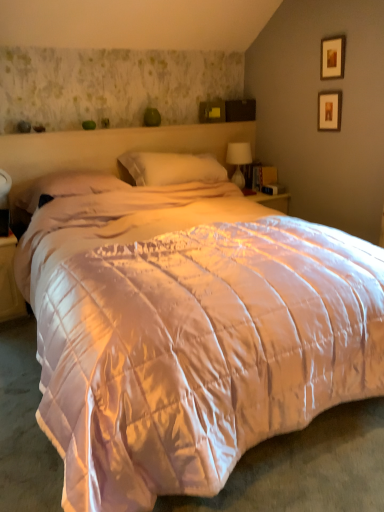
The height and width of the screenshot is (512, 384). Describe the element at coordinates (9, 281) in the screenshot. I see `matte white nightstand at lower left` at that location.

The image size is (384, 512). In order to click on white soft pillow at center, positioned as the 2th pillow in left-to-right order in this screenshot , I will do `click(169, 168)`.

The height and width of the screenshot is (512, 384). What do you see at coordinates (169, 168) in the screenshot?
I see `white soft pillow at center, positioned as the 2th pillow in left-to-right order` at bounding box center [169, 168].

What do you see at coordinates (238, 160) in the screenshot?
I see `translucent glass table lamp at upper right` at bounding box center [238, 160].

What do you see at coordinates (332, 57) in the screenshot?
I see `wooden picture frame at upper right, placed as the second picture frame when sorted from bottom to top` at bounding box center [332, 57].

In the scene shown: How much space does wooden picture frame at upper right, arranged as the second picture frame when viewed from the top, occupy horizontally?

wooden picture frame at upper right, arranged as the second picture frame when viewed from the top, is 1.82 inches wide.

Locate an element on the screen. This screenshot has height=512, width=384. wooden picture frame at upper right, acting as the first picture frame starting from the bottom is located at coordinates (329, 110).

Where is `matte white nightstand at lower left`? matte white nightstand at lower left is located at coordinates (9, 281).

Consider the image. How different are the orientations of wooden picture frame at upper right, placed as the second picture frame when sorted from bottom to top, and matte white nightstand at lower left in degrees?

They differ by 89.2 degrees in their facing directions.

Could you tell me if wooden picture frame at upper right, which appears as the 1th picture frame when viewed from the top, is turned towards matte white nightstand at lower left?

No, wooden picture frame at upper right, which appears as the 1th picture frame when viewed from the top, is not oriented towards matte white nightstand at lower left.

Is wooden picture frame at upper right, which appears as the 1th picture frame when viewed from the top, touching matte white nightstand at lower left?

No, wooden picture frame at upper right, which appears as the 1th picture frame when viewed from the top, is not with matte white nightstand at lower left.

From the picture: Does wooden picture frame at upper right, placed as the second picture frame when sorted from bottom to top, have a lesser height compared to matte white nightstand at lower left?

Yes.

Does wooden picture frame at upper right, acting as the first picture frame starting from the bottom, have a lesser width compared to translucent glass table lamp at upper right?

Yes.

From a real-world perspective, which is physically below, wooden picture frame at upper right, acting as the first picture frame starting from the bottom, or translucent glass table lamp at upper right?

In real-world perspective, translucent glass table lamp at upper right is lower.

Can you tell me how much wooden picture frame at upper right, acting as the first picture frame starting from the bottom, and translucent glass table lamp at upper right differ in facing direction?

89.7 degrees.

Is wooden picture frame at upper right, acting as the first picture frame starting from the bottom, in front of or behind translucent glass table lamp at upper right in the image?

In the image, wooden picture frame at upper right, acting as the first picture frame starting from the bottom, appears in front of translucent glass table lamp at upper right.

Are wooden picture frame at upper right, acting as the first picture frame starting from the bottom, and pink satin pillow at center, the second pillow viewed from the right, making contact?

No, wooden picture frame at upper right, acting as the first picture frame starting from the bottom, is not beside pink satin pillow at center, the second pillow viewed from the right.

Considering the positions of point (325, 112) and point (33, 203), is point (325, 112) closer or farther from the camera than point (33, 203)?

Point (325, 112) is positioned farther from the camera compared to point (33, 203).

From a real-world perspective, between wooden picture frame at upper right, arranged as the second picture frame when viewed from the top, and pink satin pillow at center, the second pillow viewed from the right, who is vertically higher?

From a 3D spatial view, wooden picture frame at upper right, arranged as the second picture frame when viewed from the top, is above.

Does wooden picture frame at upper right, acting as the first picture frame starting from the bottom, turn towards pink satin pillow at center, the second pillow viewed from the right?

Yes.

Is matte white nightstand at lower left further to camera compared to wooden picture frame at upper right, acting as the first picture frame starting from the bottom?

No, the depth of matte white nightstand at lower left is less than that of wooden picture frame at upper right, acting as the first picture frame starting from the bottom.

Is matte white nightstand at lower left next to wooden picture frame at upper right, arranged as the second picture frame when viewed from the top, and touching it?

matte white nightstand at lower left and wooden picture frame at upper right, arranged as the second picture frame when viewed from the top, are not in contact.

Would you say matte white nightstand at lower left is inside or outside wooden picture frame at upper right, arranged as the second picture frame when viewed from the top?

matte white nightstand at lower left is not enclosed by wooden picture frame at upper right, arranged as the second picture frame when viewed from the top.

Is translucent glass table lamp at upper right facing away from wooden picture frame at upper right, acting as the first picture frame starting from the bottom?

No, translucent glass table lamp at upper right's orientation is not away from wooden picture frame at upper right, acting as the first picture frame starting from the bottom.

Looking at this image, would you say translucent glass table lamp at upper right is to the left or to the right of wooden picture frame at upper right, acting as the first picture frame starting from the bottom, in the picture?

From the image, it's evident that translucent glass table lamp at upper right is to the left of wooden picture frame at upper right, acting as the first picture frame starting from the bottom.

How distant is translucent glass table lamp at upper right from wooden picture frame at upper right, arranged as the second picture frame when viewed from the top?

translucent glass table lamp at upper right and wooden picture frame at upper right, arranged as the second picture frame when viewed from the top, are 31.29 inches apart.

Consider the image. Is translucent glass table lamp at upper right not inside wooden picture frame at upper right, arranged as the second picture frame when viewed from the top?

Indeed, translucent glass table lamp at upper right is completely outside wooden picture frame at upper right, arranged as the second picture frame when viewed from the top.

Does white soft pillow at center, the 1th pillow when ordered from right to left, turn towards pink satin pillow at center, which is counted as the 1th pillow, starting from the left?

No, white soft pillow at center, the 1th pillow when ordered from right to left, is not oriented towards pink satin pillow at center, which is counted as the 1th pillow, starting from the left.

At what (x,y) coordinates should I click in order to perform the action: click on pillow above the pink satin pillow at center, the second pillow viewed from the right (from a real-world perspective). Please return your answer as a coordinate pair (x, y). The image size is (384, 512). Looking at the image, I should click on (169, 168).

From a real-world perspective, is wooden picture frame at upper right, acting as the first picture frame starting from the bottom, physically below matte white nightstand at lower left?

No, from a real-world perspective, wooden picture frame at upper right, acting as the first picture frame starting from the bottom, is not below matte white nightstand at lower left.

Can you tell me how much wooden picture frame at upper right, acting as the first picture frame starting from the bottom, and matte white nightstand at lower left differ in facing direction?

89.2 degrees separate the facing orientations of wooden picture frame at upper right, acting as the first picture frame starting from the bottom, and matte white nightstand at lower left.

This screenshot has height=512, width=384. Find the location of `nightstand lying on the left of wooden picture frame at upper right, arranged as the second picture frame when viewed from the top`. nightstand lying on the left of wooden picture frame at upper right, arranged as the second picture frame when viewed from the top is located at coordinates (9, 281).

From the image's perspective, is wooden picture frame at upper right, arranged as the second picture frame when viewed from the top, above or below matte white nightstand at lower left?

wooden picture frame at upper right, arranged as the second picture frame when viewed from the top, is above matte white nightstand at lower left.

Where is `nightstand located underneath the wooden picture frame at upper right, placed as the second picture frame when sorted from bottom to top (from a real-world perspective)`? nightstand located underneath the wooden picture frame at upper right, placed as the second picture frame when sorted from bottom to top (from a real-world perspective) is located at coordinates (9, 281).

Locate an element on the screen. the 1st picture frame in front of the translucent glass table lamp at upper right, starting your count from the anchor is located at coordinates tap(329, 110).

When comparing their distances from white soft pillow at center, positioned as the 2th pillow in left-to-right order, does translucent glass table lamp at upper right or pink satin pillow at center, the second pillow viewed from the right, seem further?

The object further to white soft pillow at center, positioned as the 2th pillow in left-to-right order, is translucent glass table lamp at upper right.

When comparing their distances from wooden picture frame at upper right, acting as the first picture frame starting from the bottom, does wooden picture frame at upper right, which appears as the 1th picture frame when viewed from the top, or pink satin pillow at center, which is counted as the 1th pillow, starting from the left, seem closer?

wooden picture frame at upper right, which appears as the 1th picture frame when viewed from the top.

Looking at the image, which one is located further to translucent glass table lamp at upper right, wooden picture frame at upper right, arranged as the second picture frame when viewed from the top, or pink satin pillow at center, the second pillow viewed from the right?

Based on the image, pink satin pillow at center, the second pillow viewed from the right, appears to be further to translucent glass table lamp at upper right.

Looking at the image, which one is located further to white soft pillow at center, the 1th pillow when ordered from right to left, wooden picture frame at upper right, which appears as the 1th picture frame when viewed from the top, or translucent glass table lamp at upper right?

wooden picture frame at upper right, which appears as the 1th picture frame when viewed from the top, is positioned further to the anchor white soft pillow at center, the 1th pillow when ordered from right to left.

From the picture: From the image, which object appears to be farther from matte white nightstand at lower left, translucent glass table lamp at upper right or wooden picture frame at upper right, placed as the second picture frame when sorted from bottom to top?

wooden picture frame at upper right, placed as the second picture frame when sorted from bottom to top, is positioned further to the anchor matte white nightstand at lower left.

Based on their spatial positions, is wooden picture frame at upper right, which appears as the 1th picture frame when viewed from the top, or pink satin pillow at center, the second pillow viewed from the right, further from matte white nightstand at lower left?

The object further to matte white nightstand at lower left is wooden picture frame at upper right, which appears as the 1th picture frame when viewed from the top.

Estimate the real-world distances between objects in this image. Which object is closer to wooden picture frame at upper right, placed as the second picture frame when sorted from bottom to top, matte white nightstand at lower left or translucent glass table lamp at upper right?

translucent glass table lamp at upper right is closer to wooden picture frame at upper right, placed as the second picture frame when sorted from bottom to top.

Based on their spatial positions, is translucent glass table lamp at upper right or wooden picture frame at upper right, arranged as the second picture frame when viewed from the top, closer to wooden picture frame at upper right, which appears as the 1th picture frame when viewed from the top?

wooden picture frame at upper right, arranged as the second picture frame when viewed from the top, is positioned closer to the anchor wooden picture frame at upper right, which appears as the 1th picture frame when viewed from the top.

I want to click on table lamp between white soft pillow at center, positioned as the 2th pillow in left-to-right order, and wooden picture frame at upper right, acting as the first picture frame starting from the bottom, in the horizontal direction, so click(x=238, y=160).

Image resolution: width=384 pixels, height=512 pixels. I want to click on picture frame between wooden picture frame at upper right, placed as the second picture frame when sorted from bottom to top, and translucent glass table lamp at upper right, along the z-axis, so click(x=329, y=110).

What are the coordinates of `pillow between pink satin pillow at center, the second pillow viewed from the right, and wooden picture frame at upper right, arranged as the second picture frame when viewed from the top` in the screenshot? It's located at (169, 168).

This screenshot has width=384, height=512. I want to click on picture frame between matte white nightstand at lower left and wooden picture frame at upper right, arranged as the second picture frame when viewed from the top, so click(332, 57).